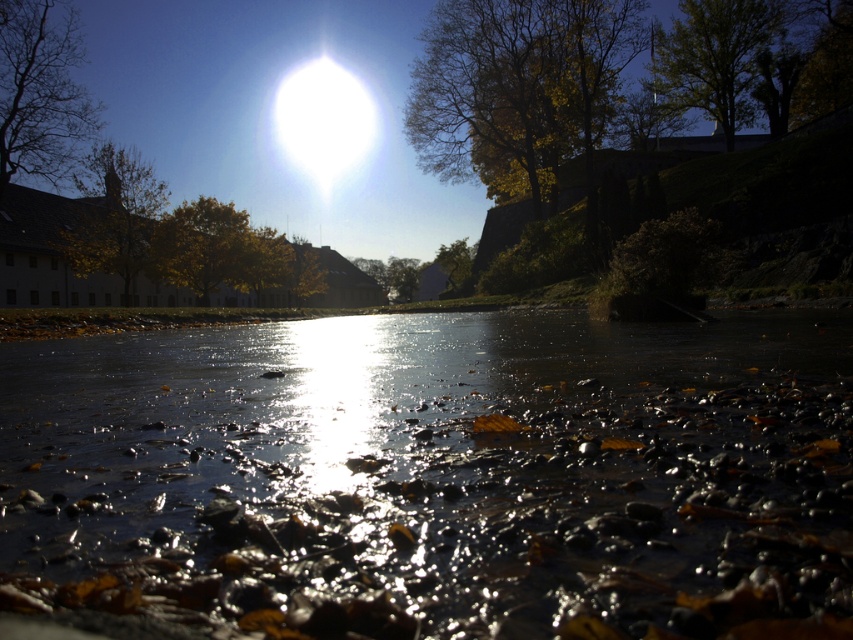
You are an artist sketching this scene. You want to ensure the golden leafy tree at upper left and green leafy tree at upper right are proportionally accurate. Which tree should you draw larger in your sketch?

The golden leafy tree at upper left should be drawn larger in the sketch since it has a larger size compared to the green leafy tree at upper right.